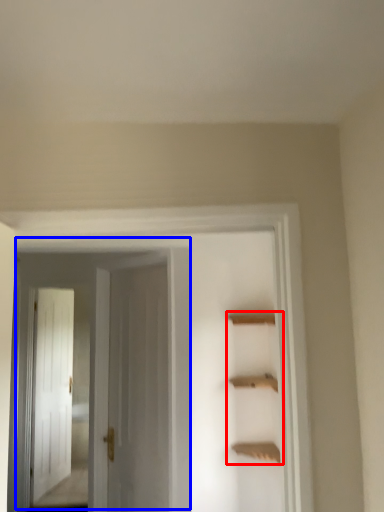
Question: Which of the following is the farthest to the observer, cabinet (highlighted by a red box) or door (highlighted by a blue box)?

Choices:
 (A) cabinet
 (B) door

Answer: (A)